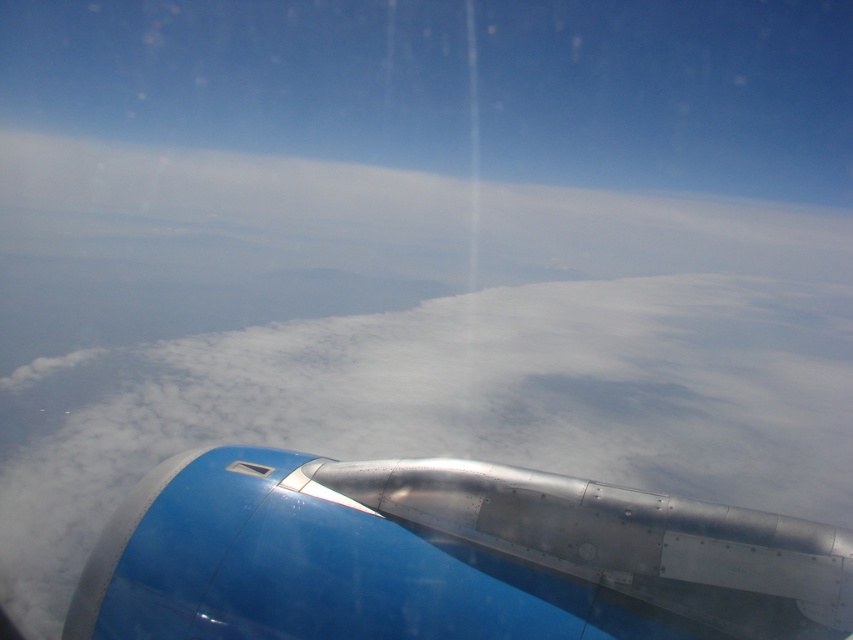
Question: Is metallic blue engine at lower left to the right of transparent plastic airplane window at lower left from the viewer's perspective?

Choices:
 (A) no
 (B) yes

Answer: (B)

Question: Can you confirm if metallic blue engine at lower left is positioned to the right of transparent plastic airplane window at lower left?

Choices:
 (A) yes
 (B) no

Answer: (A)

Question: Does metallic blue engine at lower left appear under transparent plastic airplane window at lower left?

Choices:
 (A) yes
 (B) no

Answer: (A)

Question: Which point is closer to the camera?

Choices:
 (A) metallic blue engine at lower left
 (B) transparent plastic airplane window at lower left

Answer: (A)